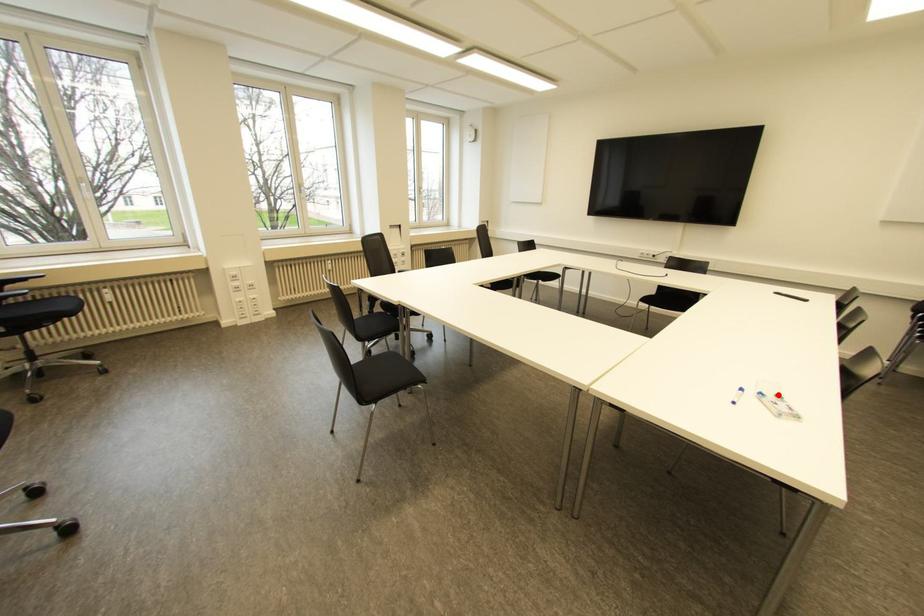
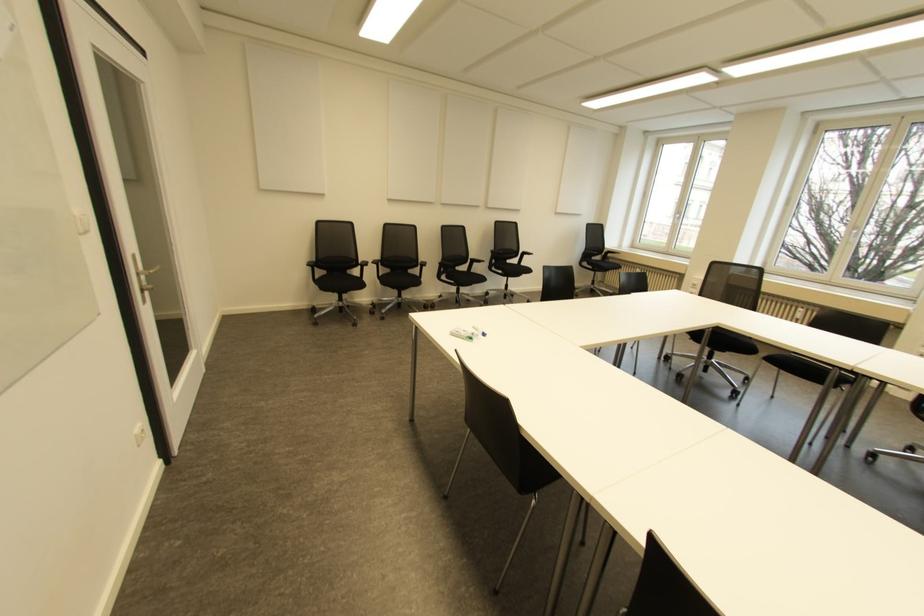
In the second image, find the point that corresponds to the highlighted location in the first image.

(470, 338)